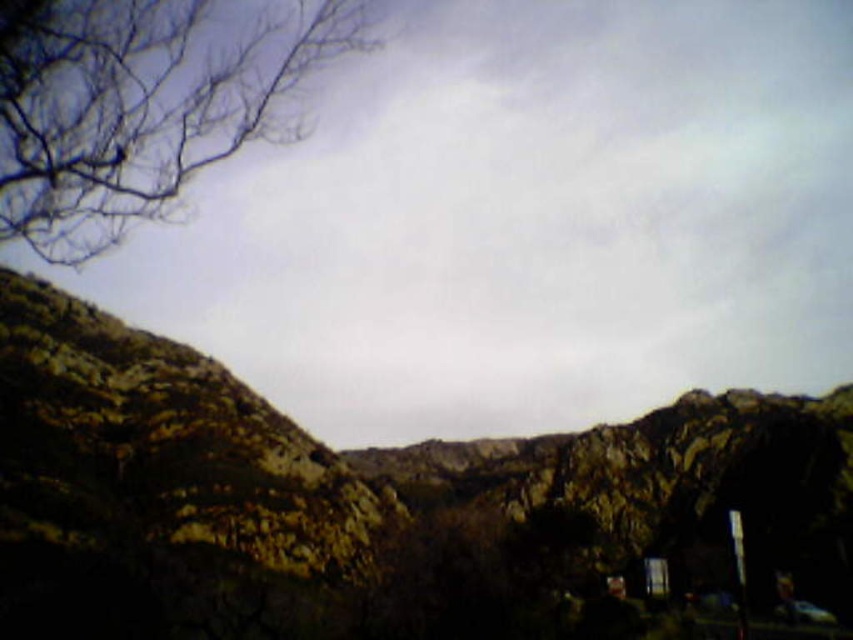
Does rugged stone mountain at center have a lesser height compared to brown/dry branches at upper left?

Indeed, rugged stone mountain at center has a lesser height compared to brown/dry branches at upper left.

Is point (265, 518) positioned behind point (312, 42)?

No, (265, 518) is in front of (312, 42).

Describe the element at coordinates (378, 506) in the screenshot. I see `rugged stone mountain at center` at that location.

You are a GUI agent. You are given a task and a screenshot of the screen. Output one action in this format:
    pyautogui.click(x=<x>, y=<y>)
    Task: Click on the rugged stone mountain at center
    
    Given the screenshot: What is the action you would take?
    pyautogui.click(x=378, y=506)

This screenshot has width=853, height=640. Find the location of `rugged stone mountain at center`. rugged stone mountain at center is located at coordinates (378, 506).

Which of these two, rugged stone mountain at center or brown rough rock at center, stands shorter?

With less height is brown rough rock at center.

At what (x,y) coordinates should I click in order to perform the action: click on rugged stone mountain at center. Please return your answer as a coordinate pair (x, y). The height and width of the screenshot is (640, 853). Looking at the image, I should click on (378, 506).

Which is above, brown rough rock at center or brown/dry branches at upper left?

Positioned higher is brown/dry branches at upper left.

Between brown rough rock at center and brown/dry branches at upper left, which one appears on the left side from the viewer's perspective?

brown/dry branches at upper left is more to the left.

Which is behind, point (338, 464) or point (154, 179)?

Point (338, 464)

Where is `brown rough rock at center`? The height and width of the screenshot is (640, 853). brown rough rock at center is located at coordinates (169, 476).